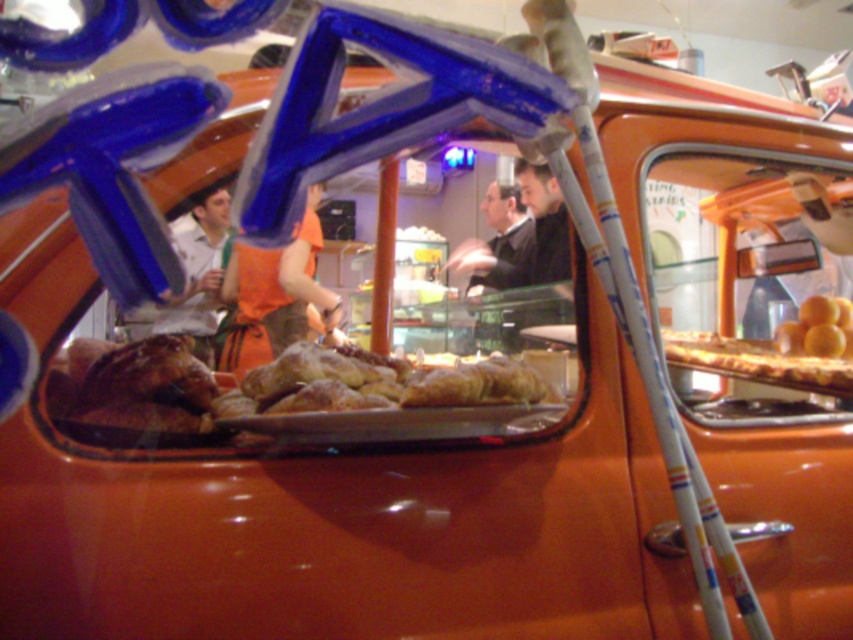
You are a customer at the bakery and want to know if the golden brown pastry at center can fit into the dark suit at center. Based on their sizes, can it fit?

The golden brown pastry at center is wider than the dark suit at center, so it cannot fit into the dark suit at center.